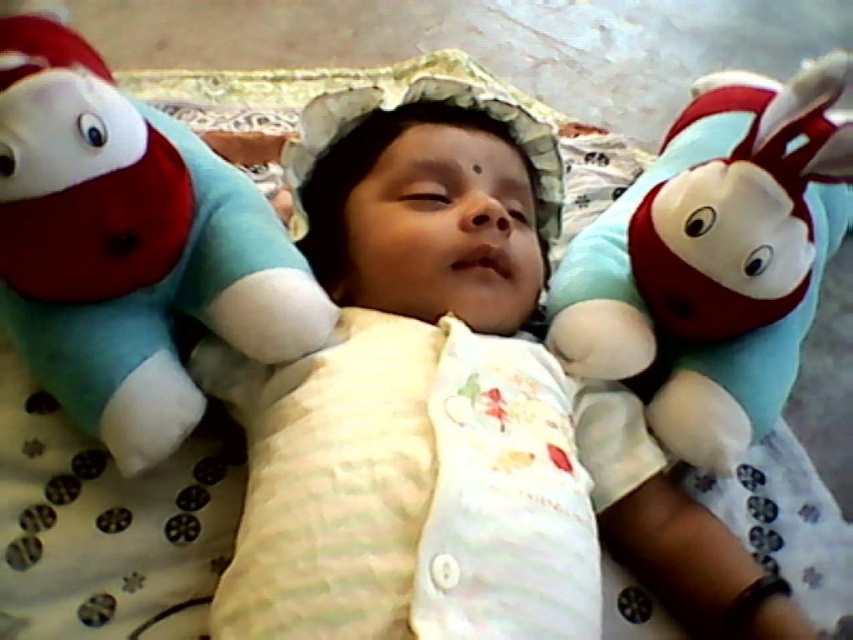
Question: Is soft plush toy at left positioned behind soft plush toy at right?

Choices:
 (A) yes
 (B) no

Answer: (B)

Question: Which of these objects is positioned closest to the soft plush toy at right?

Choices:
 (A) white soft baby at center
 (B) soft plush toy at left

Answer: (A)

Question: Is white soft baby at center wider than soft plush toy at right?

Choices:
 (A) yes
 (B) no

Answer: (A)

Question: Among these points, which one is farthest from the camera?

Choices:
 (A) (386, 378)
 (B) (13, 163)
 (C) (764, 189)

Answer: (A)

Question: Which object appears closest to the camera in this image?

Choices:
 (A) white soft baby at center
 (B) soft plush toy at left
 (C) soft plush toy at right

Answer: (A)

Question: Where is white soft baby at center located in relation to soft plush toy at left in the image?

Choices:
 (A) right
 (B) left

Answer: (A)